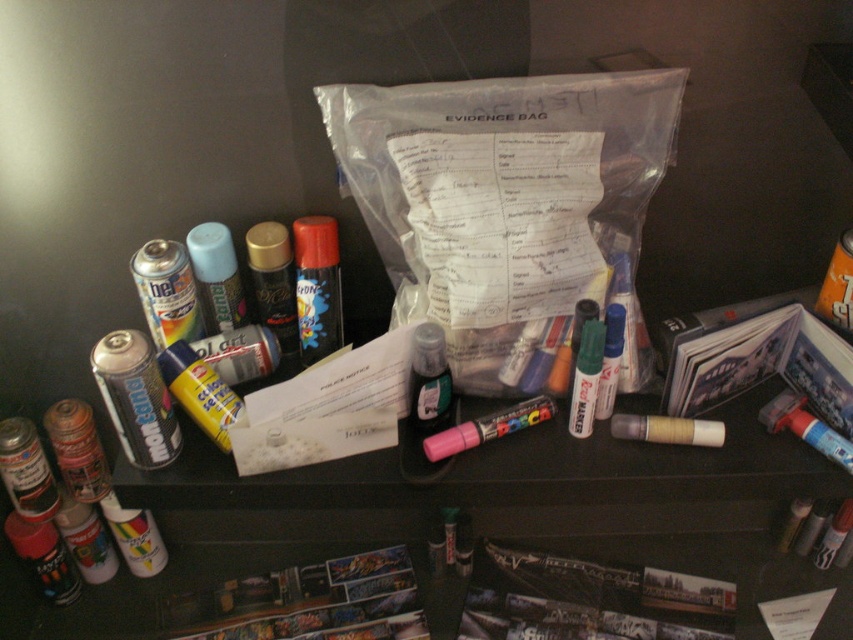
Question: Which point is closer to the camera?

Choices:
 (A) (448, 209)
 (B) (508, 428)

Answer: (A)

Question: Is transparent plastic evidence bag at center thinner than pink matte marker at center?

Choices:
 (A) yes
 (B) no

Answer: (B)

Question: Is transparent plastic evidence bag at center to the left of pink matte marker at center from the viewer's perspective?

Choices:
 (A) no
 (B) yes

Answer: (A)

Question: Is transparent plastic evidence bag at center further to the viewer compared to pink matte marker at center?

Choices:
 (A) no
 (B) yes

Answer: (A)